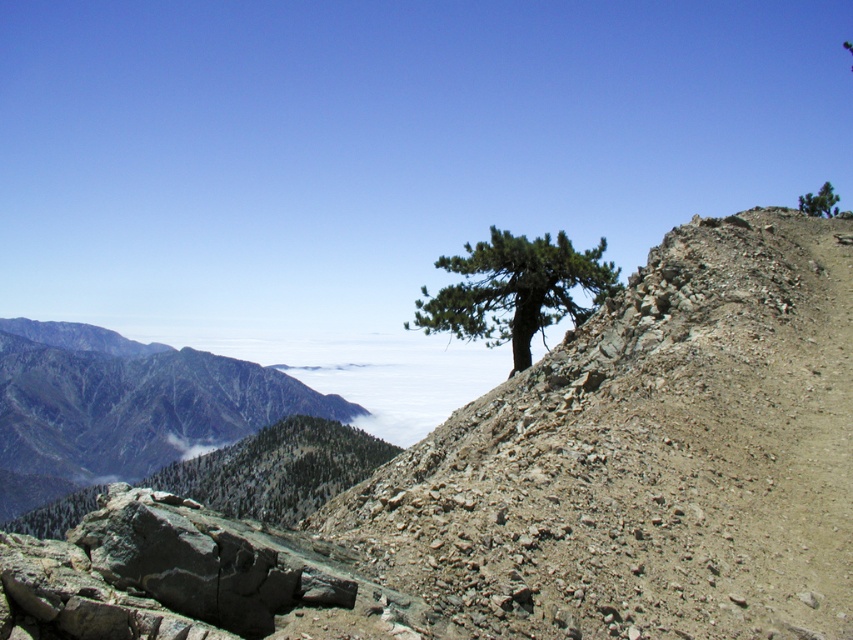
Question: Which point is closer to the camera taking this photo?

Choices:
 (A) (0, 436)
 (B) (833, 188)
 (C) (454, 326)

Answer: (C)

Question: Is green textured tree at upper center bigger than green matte tree at upper right?

Choices:
 (A) no
 (B) yes

Answer: (A)

Question: Which of the following is the closest to the observer?

Choices:
 (A) gray rocky mountain at left
 (B) green matte tree at upper right
 (C) green textured tree at upper center

Answer: (C)

Question: Which point is farther to the camera?

Choices:
 (A) (62, 339)
 (B) (819, 208)
 (C) (595, 275)

Answer: (A)

Question: Does green textured tree at upper center have a greater width compared to green matte tree at upper right?

Choices:
 (A) yes
 (B) no

Answer: (B)

Question: Is green textured tree at upper center above green matte tree at upper right?

Choices:
 (A) no
 (B) yes

Answer: (A)